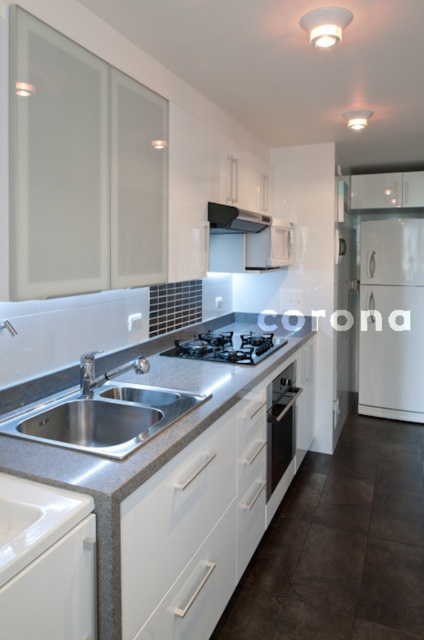
Can you confirm if white matte refrigerator at right is positioned to the right of stainless steel sink at lower left?

Yes, white matte refrigerator at right is to the right of stainless steel sink at lower left.

Is point (398, 410) farther from camera compared to point (92, 380)?

That is True.

Find the location of a particular element. This screenshot has height=640, width=424. white matte refrigerator at right is located at coordinates (392, 317).

Who is lower down, granite/stone countertop at center or black glass stove at center?

Positioned lower is granite/stone countertop at center.

Can you confirm if granite/stone countertop at center is wider than black glass stove at center?

Yes.

What do you see at coordinates (139, 490) in the screenshot? Image resolution: width=424 pixels, height=640 pixels. I see `granite/stone countertop at center` at bounding box center [139, 490].

Locate an element on the screen. Image resolution: width=424 pixels, height=640 pixels. granite/stone countertop at center is located at coordinates (139, 490).

Which is more to the right, white matte refrigerator at right or black glass stove at center?

white matte refrigerator at right is more to the right.

Does point (412, 230) lie in front of point (262, 333)?

No, it is not.

Between point (407, 280) and point (200, 340), which one is positioned behind?

The point (407, 280) is behind.

At what (x,y) coordinates should I click in order to perform the action: click on white matte refrigerator at right. Please return your answer as a coordinate pair (x, y). Looking at the image, I should click on (392, 317).